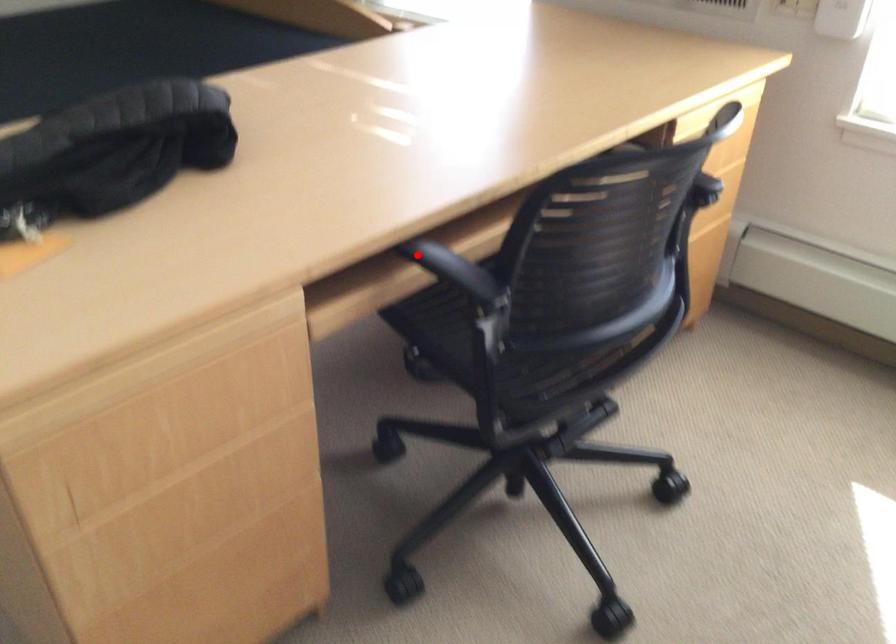
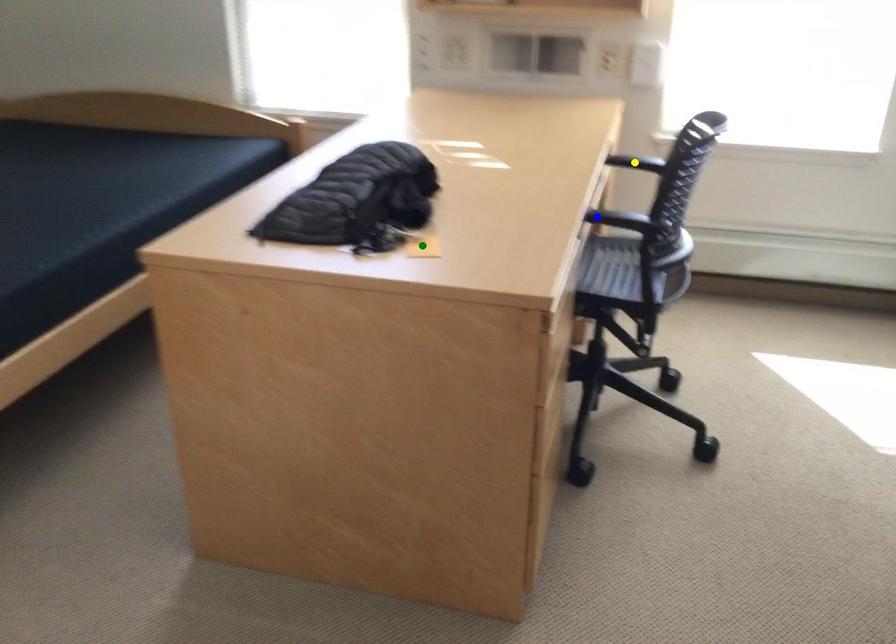
Question: I am providing you with two images of the same scene from different viewpoints. A red point is marked on the first image. You are given multiple points on the second image. Which point in image 2 is actually the same real-world point as the red point in image 1?

Choices:
 (A) yellow point
 (B) green point
 (C) blue point

Answer: (C)